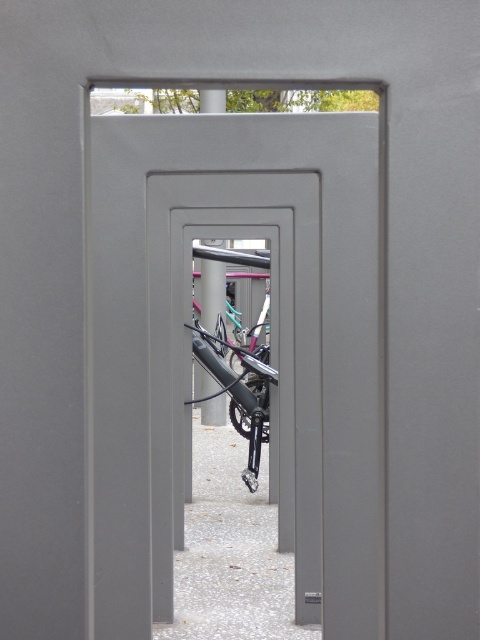
You are standing at the entrance of the tunnel formed by the rectangular openings and see the shiny metallic bicycle at center and the matte black bike at center. Which bike is positioned more to the right side of the tunnel?

The shiny metallic bicycle at center is positioned to the right of the matte black bike at center, so it is more to the right side of the tunnel.

You are a delivery person trying to load a bicycle onto a truck. The truck has a height restriction of 1.8 meters. You have to choose between the shiny metallic bicycle at center and the matte black bike at center. Which bicycle should you choose to ensure it fits under the height limit?

The shiny metallic bicycle at center is much taller than the matte black bike at center. To ensure it fits under the 1.8 meter height restriction, you should choose the matte black bike at center as it is shorter in height.

You are standing in front of the tunnel formed by the rectangular openings and want to reach the shiny metallic bicycle at center. The tunnel is 12 meters long. Can you walk straight through the tunnel to reach it without any obstacles?

The shiny metallic bicycle at center is 10.55 meters from camera, so yes, you can walk straight through the tunnel to reach it since the tunnel is 12 meters long, which is longer than the distance to the bicycle.